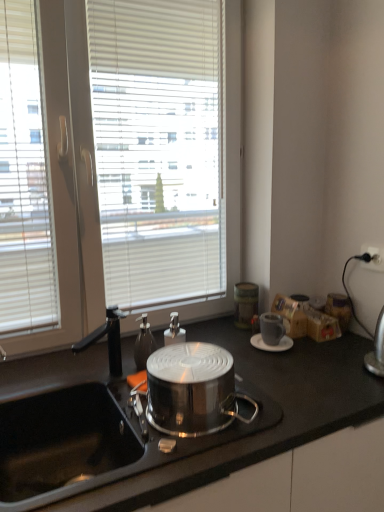
You are a GUI agent. You are given a task and a screenshot of the screen. Output one action in this format:
    pyautogui.click(x=<x>, y=<y>)
    Task: Click on the vacant point above shiny metallic pot at center (from a real-world perspective)
    Image resolution: width=384 pixels, height=512 pixels.
    Given the screenshot: What is the action you would take?
    pyautogui.click(x=194, y=362)